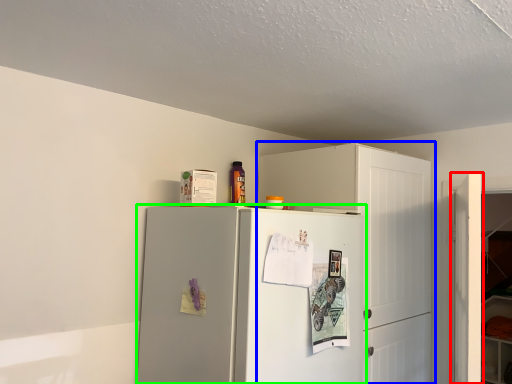
Question: Which object is positioned farthest from door (highlighted by a red box)? Select from cabinetry (highlighted by a blue box) and refrigerator (highlighted by a green box).

Choices:
 (A) cabinetry
 (B) refrigerator

Answer: (B)